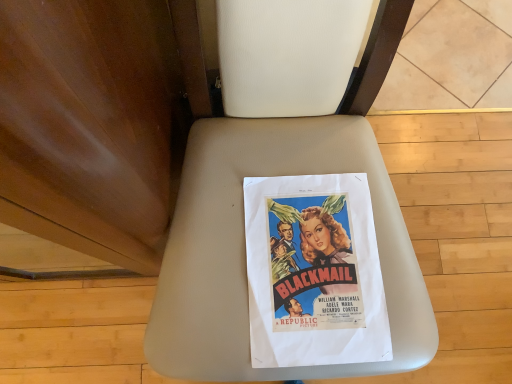
I want to click on free location to the right of beige leather chair at center, so click(x=453, y=210).